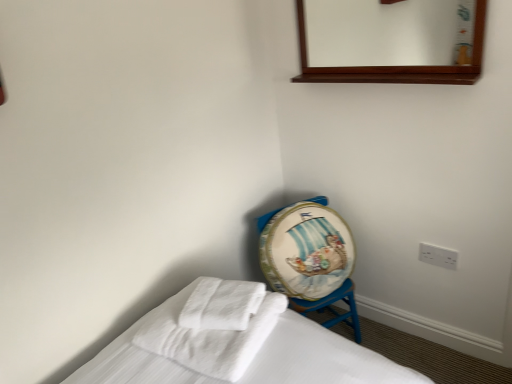
Question: In terms of width, does wooden mirror at upper center look wider or thinner when compared to white soft towel at center, the second bath towel from the left?

Choices:
 (A) thin
 (B) wide

Answer: (A)

Question: Do you think wooden mirror at upper center is within white soft towel at center, the second bath towel from the left, or outside of it?

Choices:
 (A) inside
 (B) outside

Answer: (B)

Question: Which object is positioned farthest from the painted wood drum at lower right?

Choices:
 (A) wooden mirror at upper center
 (B) white soft towel at lower left, the second bath towel in the right-to-left sequence
 (C) white soft towel at center, the second bath towel from the left
 (D) white plastic electric outlet at lower right

Answer: (A)

Question: Estimate the real-world distances between objects in this image. Which object is closer to the white soft towel at center, the 1th bath towel from the right?

Choices:
 (A) painted wood drum at lower right
 (B) wooden mirror at upper center
 (C) white plastic electric outlet at lower right
 (D) white soft towel at lower left, the second bath towel in the right-to-left sequence

Answer: (D)